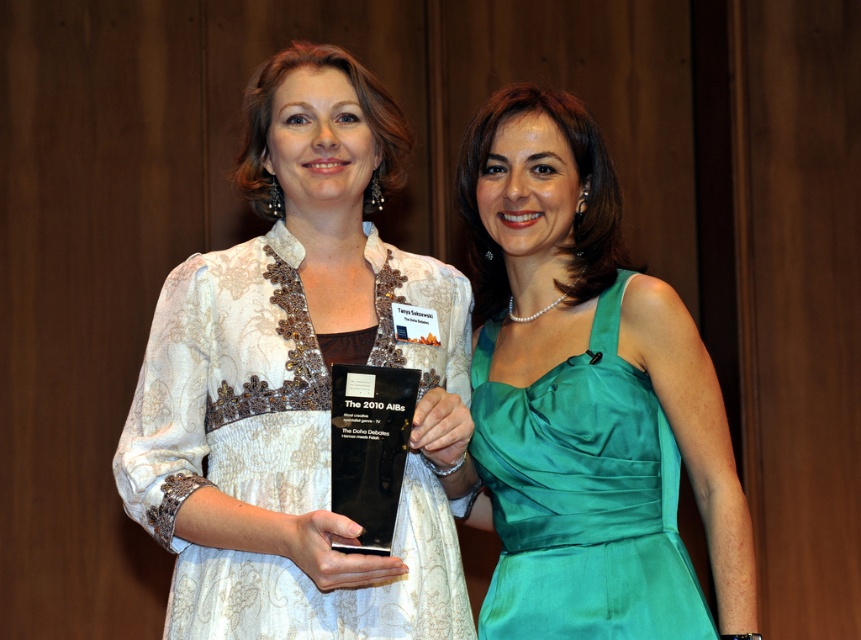
You are a photographer at the event and need to frame a closeup shot of the black glass award at center without including the emerald satin dress at right. Based on their positions and sizes, is this possible?

The emerald satin dress at right might be wider than black glass award at center, so it might be challenging to frame the black glass award at center without including the emerald satin dress at right in the shot.

Consider the image. You are a photographer at an awards ceremony. You need to position a spotlight exactly at the center of the white lace dress at center. According to the coordinates provided, what are the exact coordinates where you should place the spotlight?

The white lace dress at center is located at point [299,384], so you should place the spotlight exactly at those coordinates to center it on the white lace dress at center.

You are a photographer at an awards ceremony. You need to capture a photo of both the white lace dress at center and the emerald satin dress at right. Based on their positions, which dress is positioned higher in the frame?

The white lace dress at center is positioned higher in the frame than the emerald satin dress at right.